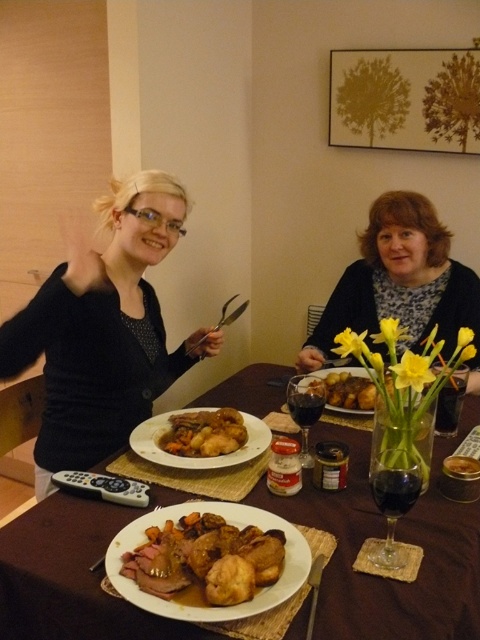
Question: Is matte black sweater at left closer to camera compared to golden brown crispy chicken at center?

Choices:
 (A) yes
 (B) no

Answer: (A)

Question: Does brown wooden table at center have a lesser width compared to golden brown crispy roast at center?

Choices:
 (A) yes
 (B) no

Answer: (B)

Question: Based on their relative distances, which object is farther from the brown crispy chicken at center?

Choices:
 (A) golden brown crispy roast at center
 (B) brown wooden table at center
 (C) matte black sweater at left
 (D) matte black sweater at center

Answer: (A)

Question: Which is nearer to the brown crispy chicken at center?

Choices:
 (A) matte black sweater at center
 (B) matte black sweater at left
 (C) brown wooden table at center

Answer: (A)

Question: Estimate the real-world distances between objects in this image. Which object is closer to the golden brown crispy chicken at center?

Choices:
 (A) matte black sweater at center
 (B) golden brown crispy roast at center
 (C) brown crispy chicken at center
 (D) brown wooden table at center

Answer: (D)

Question: Considering the relative positions of matte black sweater at center and golden brown crispy roast at center in the image provided, where is matte black sweater at center located with respect to golden brown crispy roast at center?

Choices:
 (A) above
 (B) below

Answer: (A)